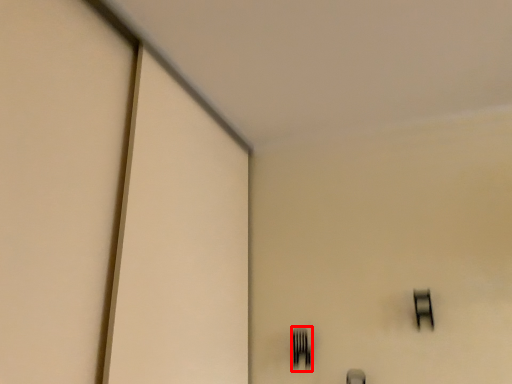
Question: From the image's perspective, where is fork (annotated by the red box) located in relation to window in the image?

Choices:
 (A) above
 (B) below

Answer: (B)